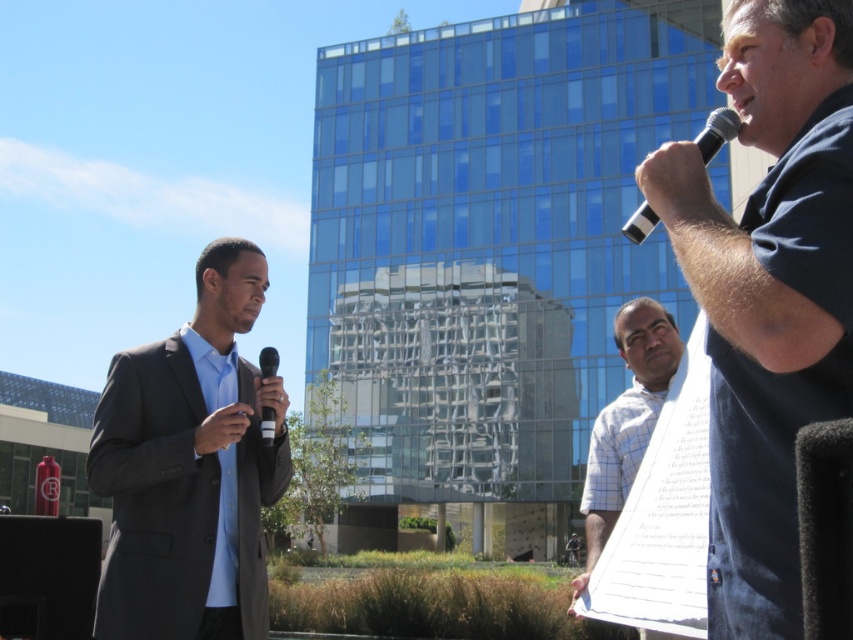
Does white checkered shirt at center have a lesser width compared to matte black microphone at lower left?

Incorrect, white checkered shirt at center's width is not less than matte black microphone at lower left's.

Does point (641, 432) come closer to viewer compared to point (0, 624)?

No, (641, 432) is behind (0, 624).

The width and height of the screenshot is (853, 640). I want to click on white checkered shirt at center, so click(x=625, y=420).

Can you confirm if dark gray suit at left is smaller than white checkered shirt at center?

Indeed, dark gray suit at left has a smaller size compared to white checkered shirt at center.

Does dark gray suit at left appear over white checkered shirt at center?

Indeed, dark gray suit at left is positioned over white checkered shirt at center.

Between point (132, 568) and point (633, 369), which one is positioned in front?

Point (132, 568)

Identify the location of dark gray suit at left. (190, 467).

Is dark gray suit at left positioned at the back of matte black microphone at lower left?

No, dark gray suit at left is in front of matte black microphone at lower left.

Between dark gray suit at left and matte black microphone at lower left, which one has more height?

dark gray suit at left is taller.

Describe the element at coordinates (190, 467) in the screenshot. I see `dark gray suit at left` at that location.

Where is `dark gray suit at left`? This screenshot has height=640, width=853. dark gray suit at left is located at coordinates (190, 467).